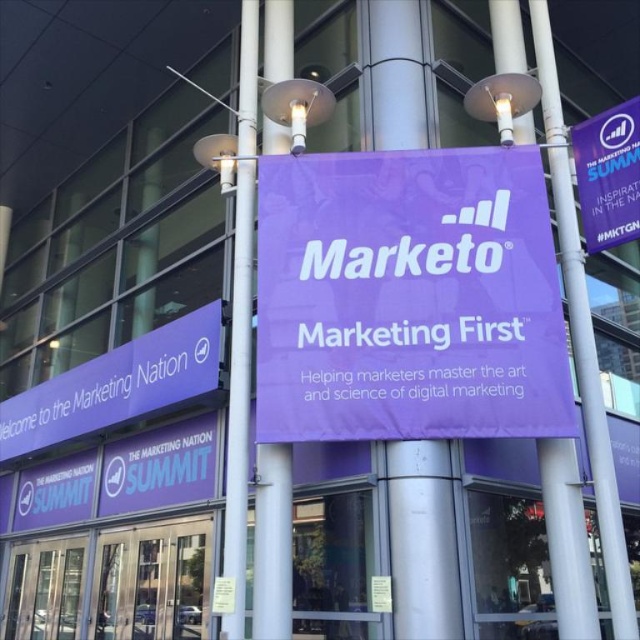
What is the coordinate of the metallic silver pole at center?

The coordinate of the metallic silver pole at center is at point (241, 326).

You are standing in front of the building and notice two points marked on the banners. The first point is at coordinates point (x=268, y=230) and the second is at point (x=116, y=348). Which point is closer to you?

Point (x=268, y=230) is in front of point (x=116, y=348), so the first point is closer to you.

What is the purpose of the point marked at coordinates (408, 298) in the image?

The point marked at coordinates (408, 298) marks the location of the purple fabric banner at center.